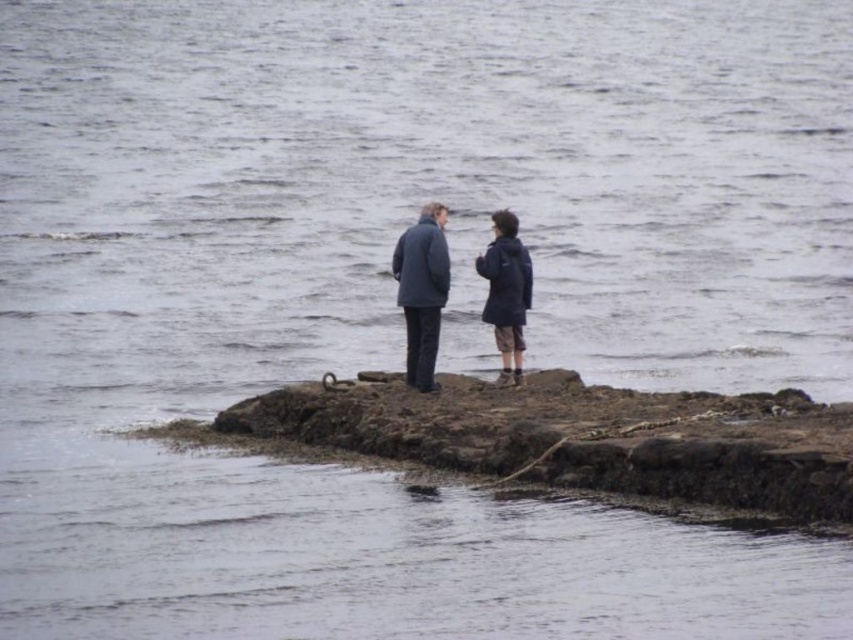
You are a hiker trying to decide which jacket to wear for a cool, damp day. You have two jackets available in your backpack. The matte blue jacket at center and the dark blue jacket at center. Based on the scene, which jacket would be more appropriate for staying warm?

The dark blue jacket at center is thicker than the matte blue jacket at center, so it would provide better warmth for a cool, damp day.

You are a photographer trying to capture a photo of both the dark gray wool coat at center and the dark blue jacket at center. Since you want both subjects to be clearly visible, which one should you focus on first to ensure the other remains in focus?

The dark gray wool coat at center is in front of the dark blue jacket at center, so you should focus on the dark gray wool coat at center first. This ensures that the dark blue jacket at center will also be in focus as it is behind the first subject.